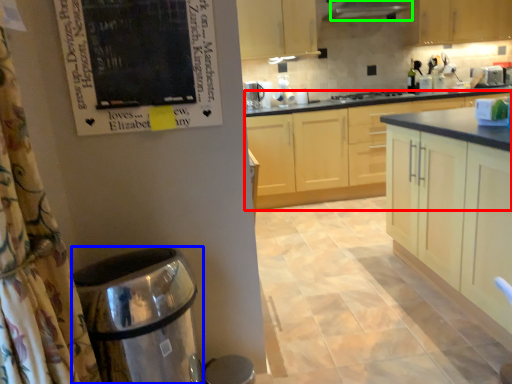
Question: Which object is the closest to the cabinetry (highlighted by a red box)? Choose among these: water heater (highlighted by a blue box) or exhaust hood (highlighted by a green box).

Choices:
 (A) water heater
 (B) exhaust hood

Answer: (B)